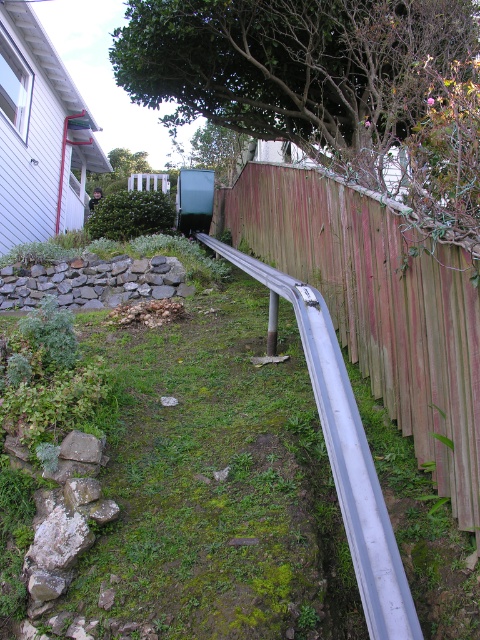
Question: Considering the relative positions of silver metallic rail at right and gray stone wall at center-left in the image provided, where is silver metallic rail at right located with respect to gray stone wall at center-left?

Choices:
 (A) above
 (B) below

Answer: (B)

Question: Considering the relative positions of silver metallic rail at right and gray stone wall at center-left in the image provided, where is silver metallic rail at right located with respect to gray stone wall at center-left?

Choices:
 (A) above
 (B) below

Answer: (B)

Question: Does silver metallic rail at right have a lesser width compared to gray stone wall at center-left?

Choices:
 (A) yes
 (B) no

Answer: (A)

Question: Which of the following is the farthest from the observer?

Choices:
 (A) (375, 499)
 (B) (31, 292)

Answer: (B)

Question: Which object is closer to the camera taking this photo?

Choices:
 (A) gray stone wall at center-left
 (B) silver metallic rail at right

Answer: (B)